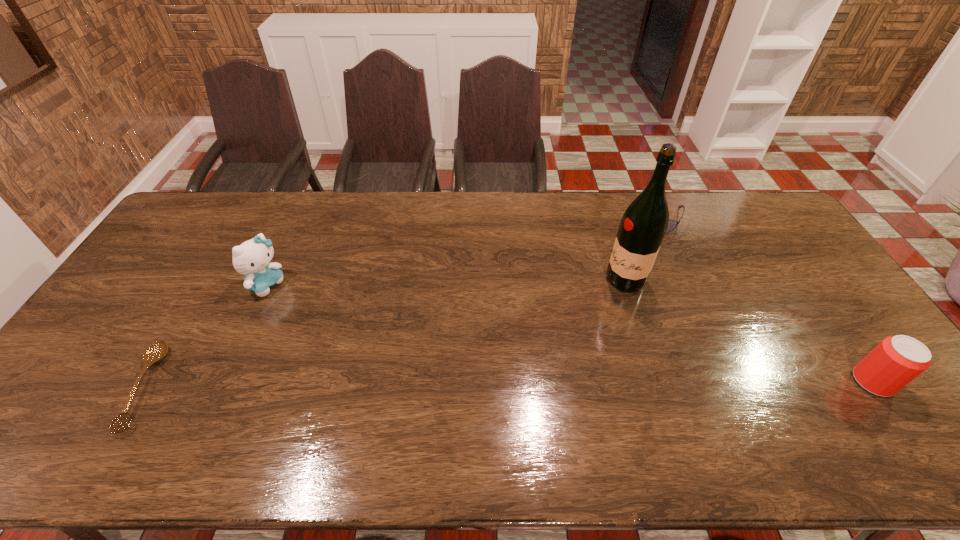
Identify the location of ladle. (158, 350).

This screenshot has height=540, width=960. I want to click on the shortest object, so click(158, 350).

This screenshot has width=960, height=540. I want to click on the rightmost object, so click(x=896, y=361).

Find the location of a particular element. beer can is located at coordinates (896, 361).

At what (x,y) coordinates should I click in order to perform the action: click on the tallest object. Please return your answer as a coordinate pair (x, y). This screenshot has height=540, width=960. Looking at the image, I should click on (643, 226).

Find the location of `liquor`. liquor is located at coordinates (643, 226).

Identify the location of the second object from left to right. The height and width of the screenshot is (540, 960). (252, 257).

Locate an element on the screen. Image resolution: width=960 pixels, height=540 pixels. the fourth shortest object is located at coordinates (252, 257).

The height and width of the screenshot is (540, 960). What are the coordinates of `the fourth tallest object` in the screenshot? It's located at (672, 224).

Identify the location of the fourth object from left to right. Image resolution: width=960 pixels, height=540 pixels. coord(672,224).